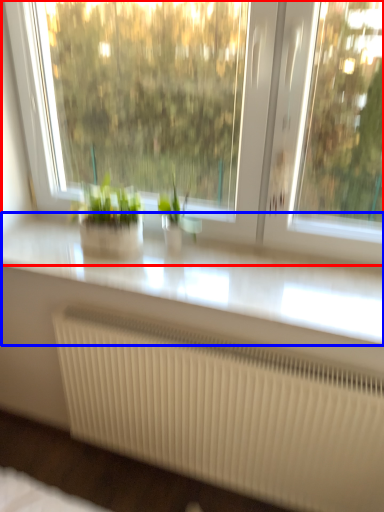
Question: Which object is further to the camera taking this photo, window (highlighted by a red box) or counter top (highlighted by a blue box)?

Choices:
 (A) window
 (B) counter top

Answer: (B)